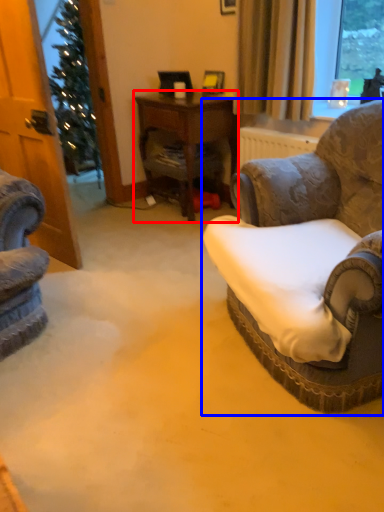
Question: Which object appears farthest to the camera in this image, desk (highlighted by a red box) or chair (highlighted by a blue box)?

Choices:
 (A) desk
 (B) chair

Answer: (A)